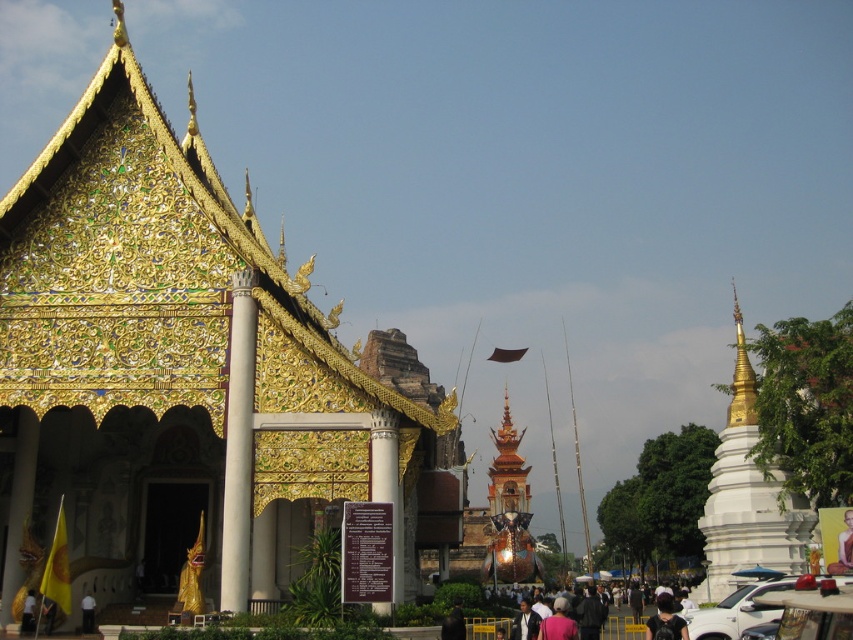
Question: Which point appears closest to the camera in this image?

Choices:
 (A) (91, 616)
 (B) (549, 628)
 (C) (683, 632)

Answer: (C)

Question: Does white metallic car at lower right lie in front of dark blue suit at center?

Choices:
 (A) no
 (B) yes

Answer: (B)

Question: Which object is the farthest from the white polished stone pillar at center?

Choices:
 (A) dark gray fabric jacket at center
 (B) white matte person at center

Answer: (B)

Question: Does white metallic car at lower right have a greater width compared to dark gray fabric jacket at center?

Choices:
 (A) yes
 (B) no

Answer: (A)

Question: Is white glossy column at center positioned behind white polished stone pillar at center?

Choices:
 (A) no
 (B) yes

Answer: (B)

Question: Which point is farther from the camera taking this photo?

Choices:
 (A) (7, 512)
 (B) (239, 454)
 (C) (703, 630)
 (D) (379, 432)

Answer: (A)